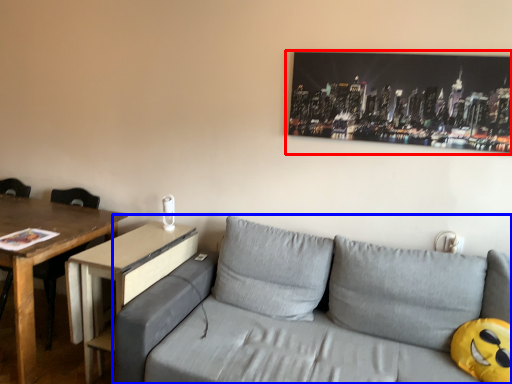
Question: Among these objects, which one is nearest to the camera, picture frame (highlighted by a red box) or studio couch (highlighted by a blue box)?

Choices:
 (A) picture frame
 (B) studio couch

Answer: (B)